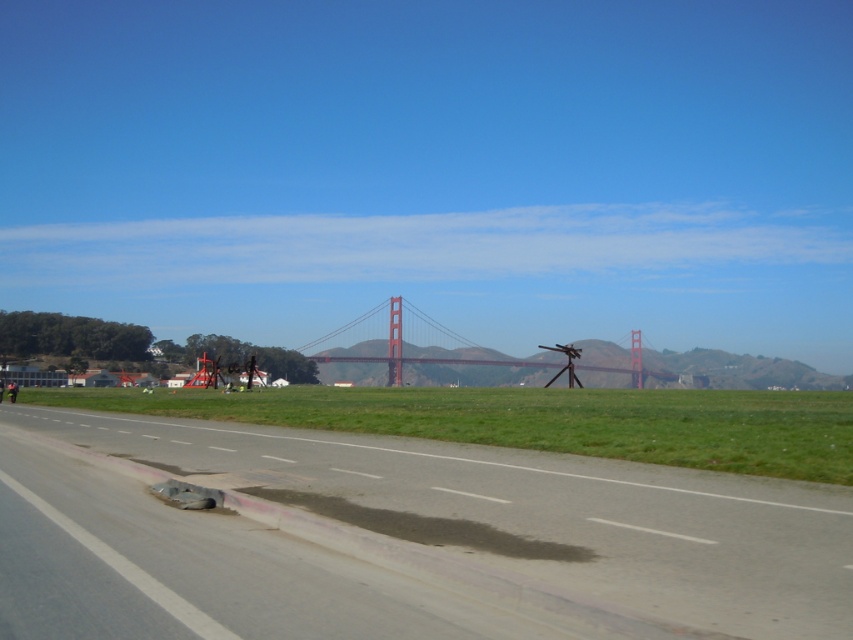
Question: Which object is farther from the camera taking this photo?

Choices:
 (A) gray asphalt runway at center
 (B) red metallic bridge at center

Answer: (B)

Question: Which of the following is the closest to the observer?

Choices:
 (A) red metallic bridge at center
 (B) gray asphalt runway at center

Answer: (B)

Question: Which point is closer to the camera taking this photo?

Choices:
 (A) (415, 337)
 (B) (83, 632)

Answer: (B)

Question: Is gray asphalt runway at center smaller than red metallic bridge at center?

Choices:
 (A) yes
 (B) no

Answer: (A)

Question: Is gray asphalt runway at center behind red metallic bridge at center?

Choices:
 (A) no
 (B) yes

Answer: (A)

Question: Is gray asphalt runway at center to the right of red metallic bridge at center from the viewer's perspective?

Choices:
 (A) no
 (B) yes

Answer: (A)